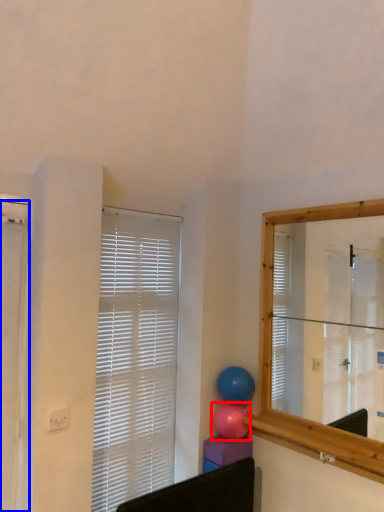
Question: Which point is closer to the camera, balloon (highlighted by a red box) or window blind (highlighted by a blue box)?

Choices:
 (A) balloon
 (B) window blind

Answer: (B)